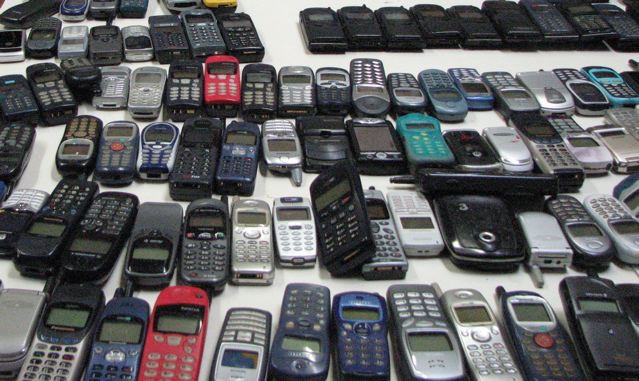
The width and height of the screenshot is (639, 381). I want to click on phones, so click(378, 109).